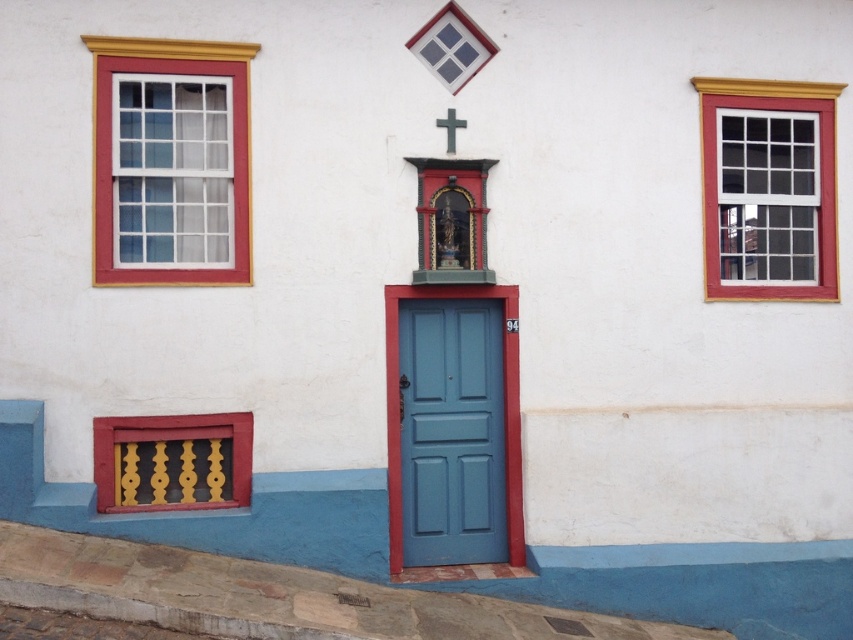
Question: Among these points, which one is farthest from the camera?

Choices:
 (A) (456, 116)
 (B) (776, 262)

Answer: (B)

Question: Which object is farther from the camera taking this photo?

Choices:
 (A) white glass window at right
 (B) blue matte door at center

Answer: (A)

Question: Which object is farther from the camera taking this photo?

Choices:
 (A) white glass window at right
 (B) white matte cross at upper center

Answer: (A)

Question: Does matte white glass window at left appear on the right side of white glass window at right?

Choices:
 (A) no
 (B) yes

Answer: (A)

Question: Is matte white glass window at left closer to camera compared to white glass window at right?

Choices:
 (A) yes
 (B) no

Answer: (A)

Question: Is blue matte door at center further to the viewer compared to white matte cross at upper center?

Choices:
 (A) no
 (B) yes

Answer: (A)